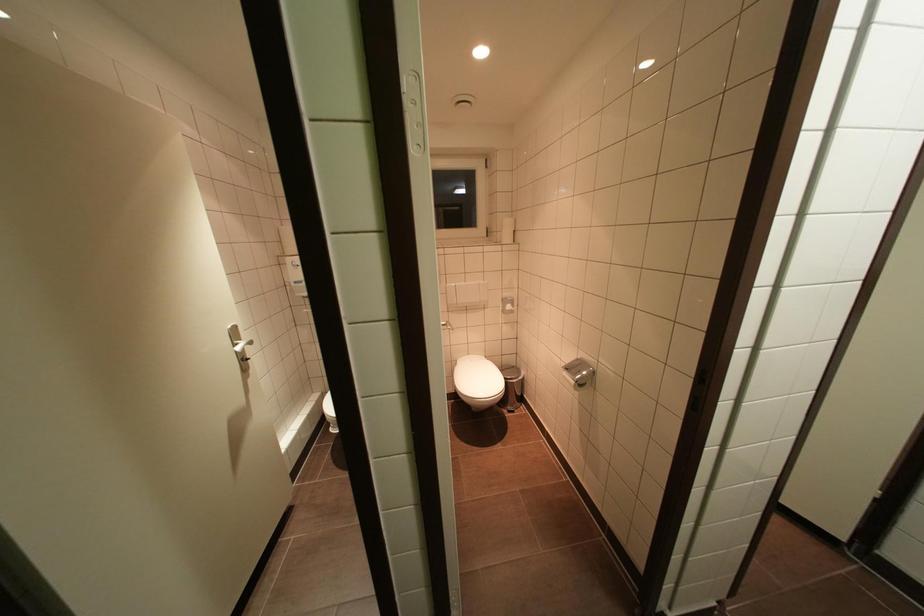
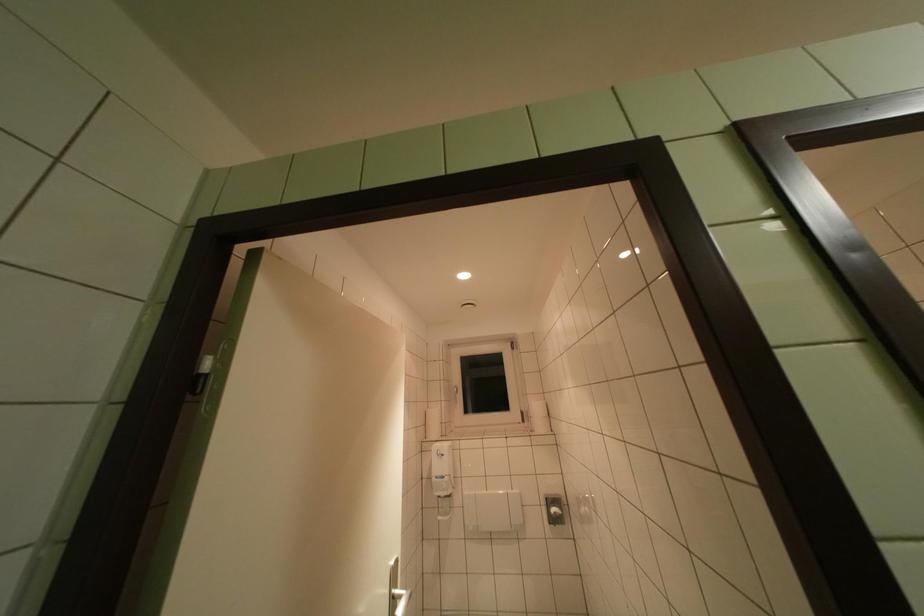
How did the camera likely rotate?

The rotation direction of the camera is left-up.